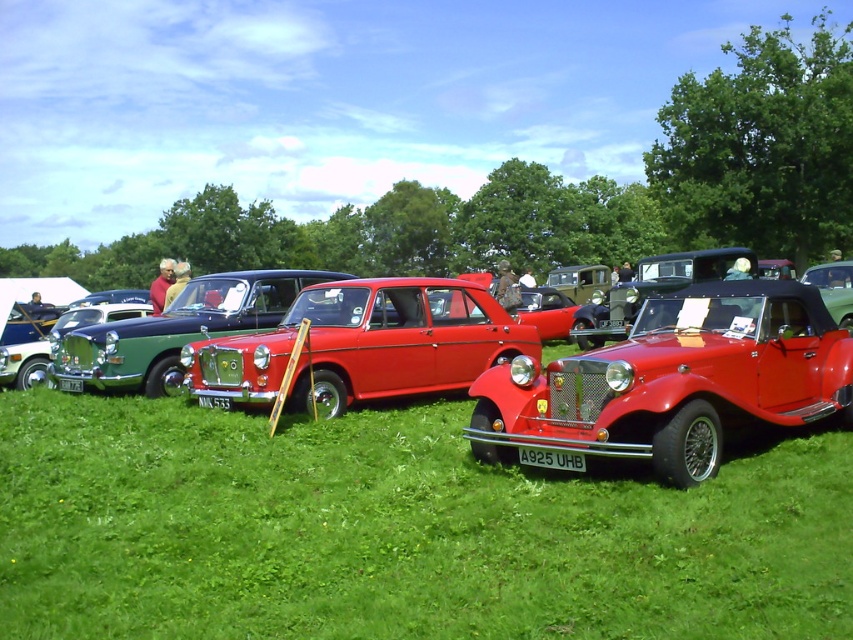
Question: From the image, what is the correct spatial relationship of shiny red car at center in relation to shiny red convertible at center?

Choices:
 (A) above
 (B) below

Answer: (A)

Question: Which of the following is the farthest from the observer?

Choices:
 (A) (383, 428)
 (B) (784, 314)
 (C) (445, 339)

Answer: (C)

Question: Among these objects, which one is farthest from the camera?

Choices:
 (A) glossy red sedan at center
 (B) shiny red convertible at center
 (C) shiny metallic sedan at center
 (D) shiny red car at center

Answer: (C)

Question: Is glossy red sedan at center above shiny metallic sedan at center?

Choices:
 (A) no
 (B) yes

Answer: (A)

Question: Which point appears farthest from the camera in this image?

Choices:
 (A) (776, 298)
 (B) (834, 476)

Answer: (A)

Question: Can you confirm if shiny red car at center is bigger than shiny red convertible at center?

Choices:
 (A) no
 (B) yes

Answer: (B)